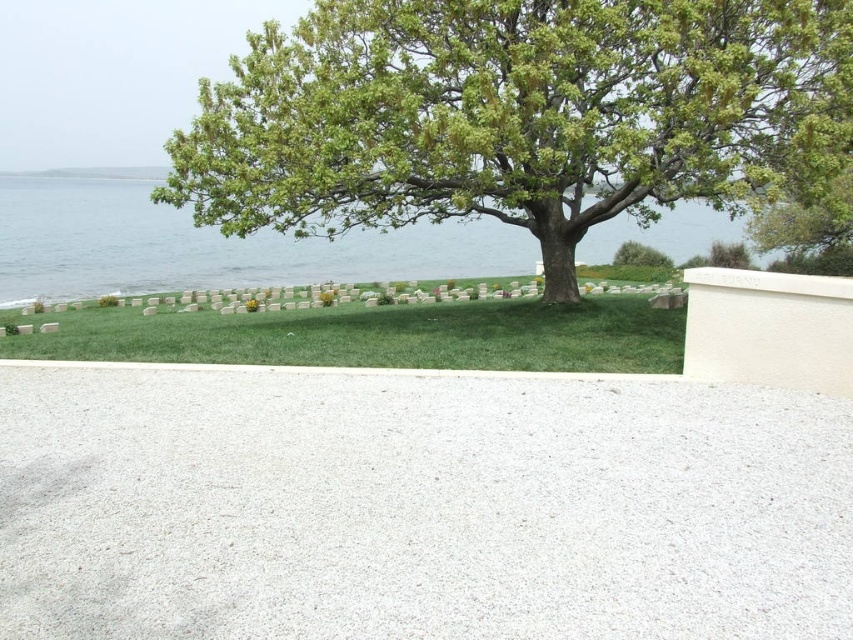
Question: Which of the following is the closest to the observer?

Choices:
 (A) green leafy tree at center
 (B) green grass at center
 (C) green water at upper center

Answer: (A)

Question: Is the position of green leafy tree at center less distant than that of green water at upper center?

Choices:
 (A) no
 (B) yes

Answer: (B)

Question: Which of the following is the closest to the observer?

Choices:
 (A) green water at upper center
 (B) green grass at center

Answer: (B)

Question: Does green leafy tree at center appear over green water at upper center?

Choices:
 (A) yes
 (B) no

Answer: (B)

Question: Which point appears closest to the camera in this image?

Choices:
 (A) (584, 145)
 (B) (380, 266)
 (C) (431, 314)

Answer: (A)

Question: Is green leafy tree at center thinner than green water at upper center?

Choices:
 (A) yes
 (B) no

Answer: (A)